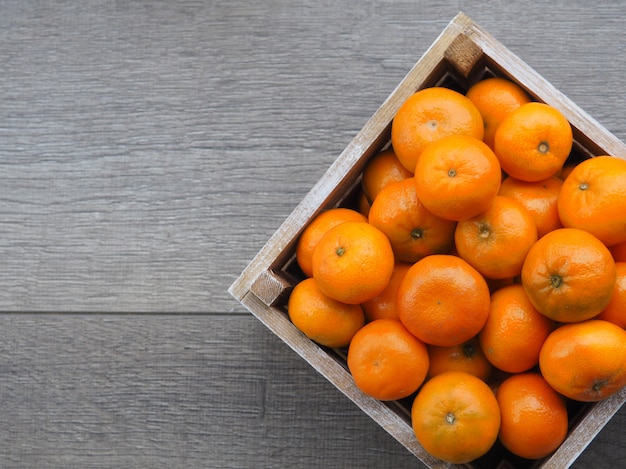
Where is `side of wooden box`? The height and width of the screenshot is (469, 626). side of wooden box is located at coordinates (337, 163), (349, 385), (557, 91), (608, 416).